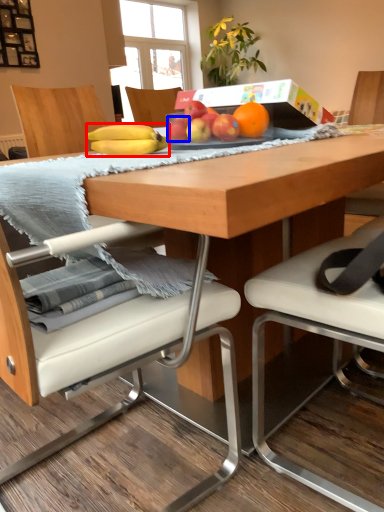
Question: Which of the following is the farthest to the observer, banana (highlighted by a red box) or apple (highlighted by a blue box)?

Choices:
 (A) banana
 (B) apple

Answer: (B)